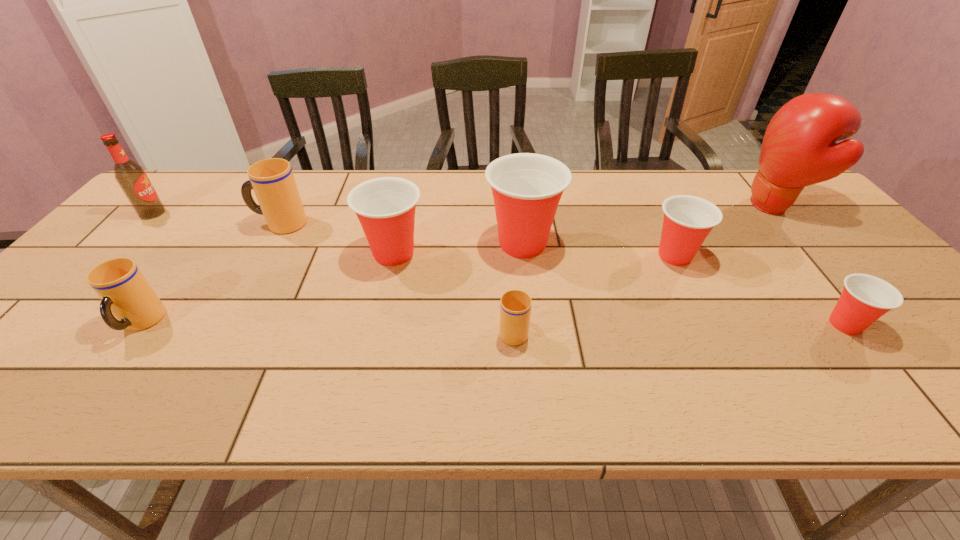
Identify the location of free point located 0.150m on the side of the rightmost beige cup with the handle. (509, 271).

Locate an element on the screen. The width and height of the screenshot is (960, 540). boxing glove present at the far edge is located at coordinates 799,148.

You are a GUI agent. You are given a task and a screenshot of the screen. Output one action in this format:
    pyautogui.click(x=<x>, y=<y>)
    Task: Click on the beer bottle that is at the far edge
    Image resolution: width=960 pixels, height=540 pixels.
    Given the screenshot: What is the action you would take?
    pyautogui.click(x=131, y=177)

Locate an element on the screen. The height and width of the screenshot is (540, 960). object present at the left edge is located at coordinates click(x=131, y=177).

This screenshot has width=960, height=540. In order to click on boxing glove at the right edge in this screenshot , I will do `click(799, 148)`.

I want to click on cup located at the right edge, so click(865, 298).

Image resolution: width=960 pixels, height=540 pixels. Find the location of `object that is at the far left corner`. object that is at the far left corner is located at coordinates (131, 177).

The width and height of the screenshot is (960, 540). In order to click on object that is at the far right corner in this screenshot , I will do `click(799, 148)`.

Image resolution: width=960 pixels, height=540 pixels. I want to click on free space at the far edge of the desktop, so click(649, 187).

Identify the location of vacant area at the near edge of the desktop. (379, 401).